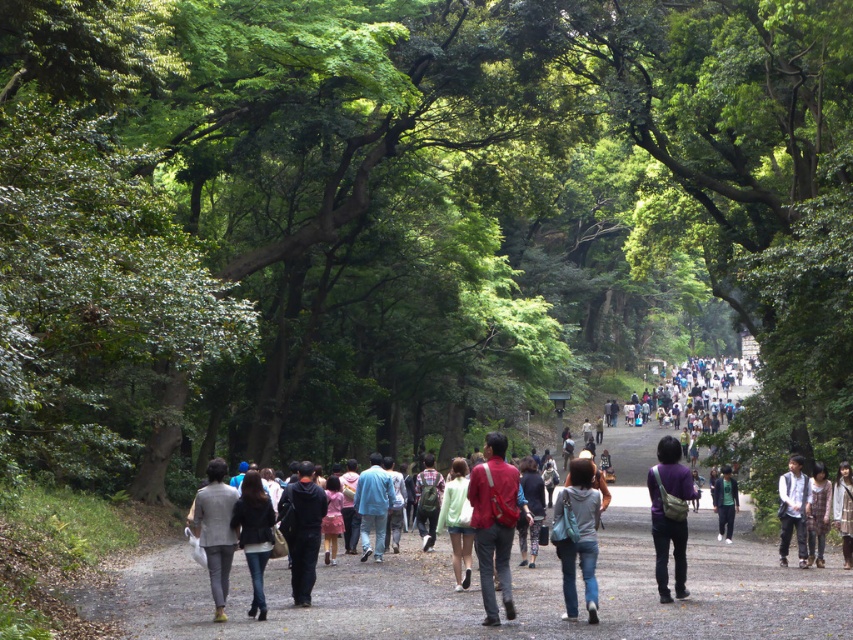
You are standing at the point labeled point (x=788, y=499) and want to walk towards the point labeled point (x=439, y=481). Which direction should you face to move directly towards it?

Since point (x=788, y=499) is closer to the camera than point (x=439, y=481), you should face downwards to move directly towards it.

You are a photographer trying to capture a candid shot of the denim jeans at center and the green cotton shirt at center in the park scene. Based on their positions, which clothing item is positioned higher in the image?

The denim jeans at center is above the green cotton shirt at center in the image.

You are a photographer trying to capture a candid shot of the denim jeans at center and the green cotton shirt at center in the park scene. Since you want both subjects to be clearly visible in the frame, which object should you focus on to ensure it doesn t get cropped out?

The green cotton shirt at center occupies more space than the denim jeans at center, so you should focus on ensuring the green cotton shirt at center is fully within the frame to prevent cropping.